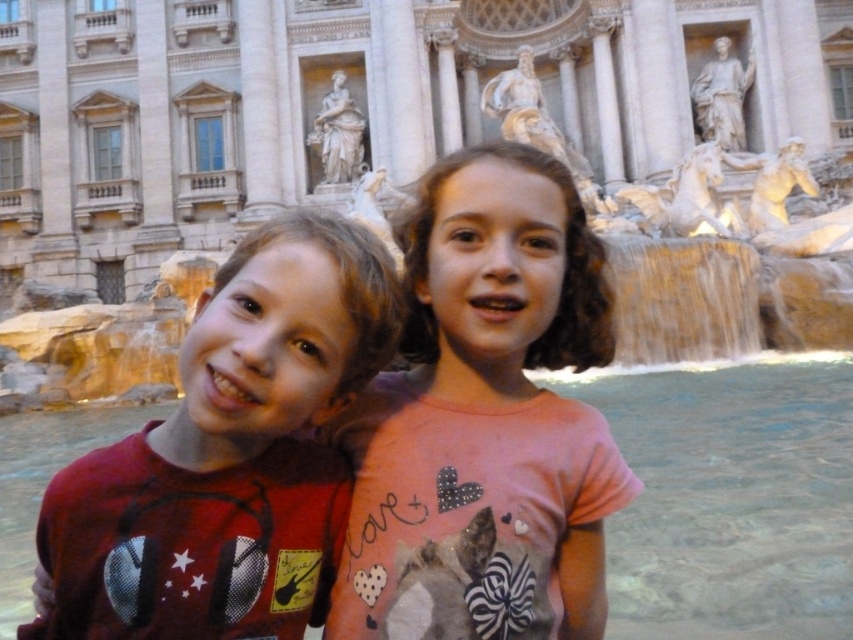
Question: Which is farther from the stone marble palace at center?

Choices:
 (A) matte red shirt at center
 (B) pink fabric shirt at center

Answer: (A)

Question: Can you confirm if pink fabric shirt at center is positioned below matte red shirt at center?

Choices:
 (A) no
 (B) yes

Answer: (A)

Question: Can you confirm if stone marble palace at center is bigger than pink fabric shirt at center?

Choices:
 (A) yes
 (B) no

Answer: (A)

Question: Among these objects, which one is nearest to the camera?

Choices:
 (A) stone marble palace at center
 (B) matte red shirt at center
 (C) pink fabric shirt at center

Answer: (B)

Question: From the image, what is the correct spatial relationship of stone marble palace at center in relation to pink fabric shirt at center?

Choices:
 (A) left
 (B) right

Answer: (A)

Question: Which of the following is the closest to the observer?

Choices:
 (A) matte red shirt at center
 (B) stone marble palace at center
 (C) pink fabric shirt at center

Answer: (A)